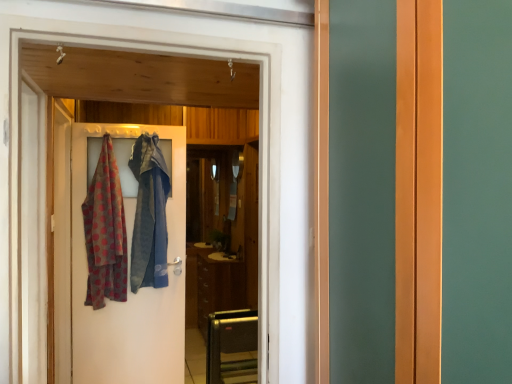
Question: Would you consider polka dot fabric at left to be distant from wooden door at center?

Choices:
 (A) yes
 (B) no

Answer: (A)

Question: Is polka dot fabric at left positioned before wooden door at center?

Choices:
 (A) yes
 (B) no

Answer: (B)

Question: Can you confirm if polka dot fabric at left is positioned to the right of wooden door at center?

Choices:
 (A) no
 (B) yes

Answer: (A)

Question: Can wooden door at center be found inside polka dot fabric at left?

Choices:
 (A) no
 (B) yes

Answer: (A)

Question: Considering the relative sizes of polka dot fabric at left and wooden door at center in the image provided, is polka dot fabric at left bigger than wooden door at center?

Choices:
 (A) no
 (B) yes

Answer: (B)

Question: Can you confirm if polka dot fabric at left is wider than wooden door at center?

Choices:
 (A) yes
 (B) no

Answer: (B)

Question: Is brown matte cabinet at center facing away from wooden door at center?

Choices:
 (A) yes
 (B) no

Answer: (B)

Question: Considering the relative positions of brown matte cabinet at center and wooden door at center in the image provided, is brown matte cabinet at center to the right of wooden door at center from the viewer's perspective?

Choices:
 (A) no
 (B) yes

Answer: (A)

Question: Does brown matte cabinet at center have a greater width compared to wooden door at center?

Choices:
 (A) yes
 (B) no

Answer: (A)

Question: From a real-world perspective, is brown matte cabinet at center on top of wooden door at center?

Choices:
 (A) yes
 (B) no

Answer: (B)

Question: Considering the relative sizes of brown matte cabinet at center and wooden door at center in the image provided, is brown matte cabinet at center bigger than wooden door at center?

Choices:
 (A) no
 (B) yes

Answer: (B)

Question: Is brown matte cabinet at center taller than wooden door at center?

Choices:
 (A) no
 (B) yes

Answer: (A)

Question: Is wooden door at center closer to camera compared to brown matte cabinet at center?

Choices:
 (A) no
 (B) yes

Answer: (B)